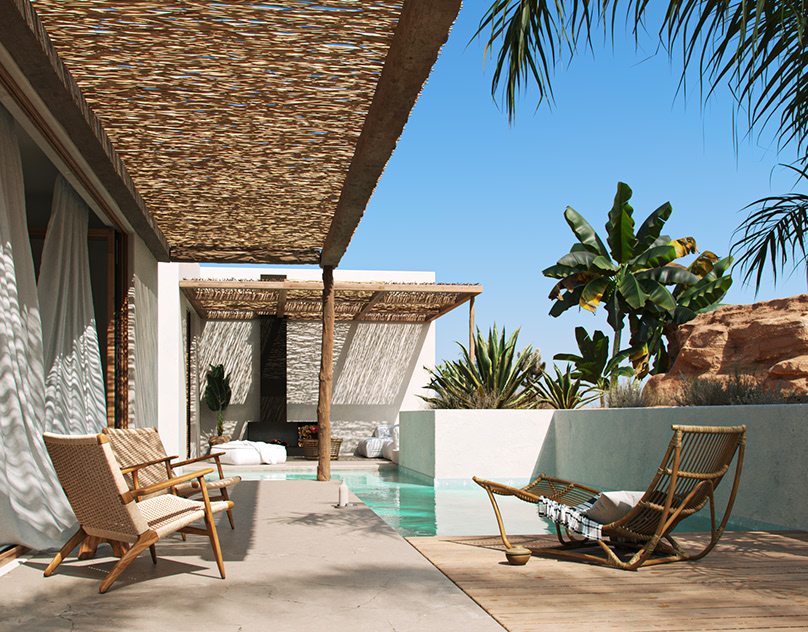
The image size is (808, 632). Find the location of `plant in corner on the left in the back on the wall`. plant in corner on the left in the back on the wall is located at coordinates (213, 383).